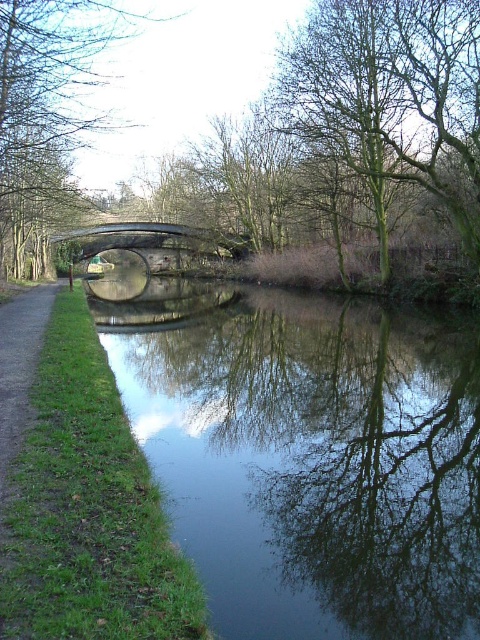
Who is positioned more to the right, green leafy tree at upper center or green leafy tree at left?

green leafy tree at upper center

Is green leafy tree at upper center positioned before green leafy tree at left?

No, it is behind green leafy tree at left.

Is point (429, 113) behind point (60, 61)?

That is True.

This screenshot has width=480, height=640. Identify the location of green leafy tree at upper center. (391, 96).

Is point (259, 353) more distant than point (335, 20)?

That is False.

Is clear glass water at center positioned in front of green leafy tree at upper center?

Yes, it is in front of green leafy tree at upper center.

Between point (423, 600) and point (469, 42), which one is positioned behind?

The point (469, 42) is more distant.

Image resolution: width=480 pixels, height=640 pixels. Find the location of `clear glass water at center`. clear glass water at center is located at coordinates (305, 456).

From the picture: Does clear glass water at center have a lesser height compared to metallic gray bridge at center?

Yes.

Between clear glass water at center and metallic gray bridge at center, which one appears on the left side from the viewer's perspective?

metallic gray bridge at center

The width and height of the screenshot is (480, 640). Identify the location of clear glass water at center. click(305, 456).